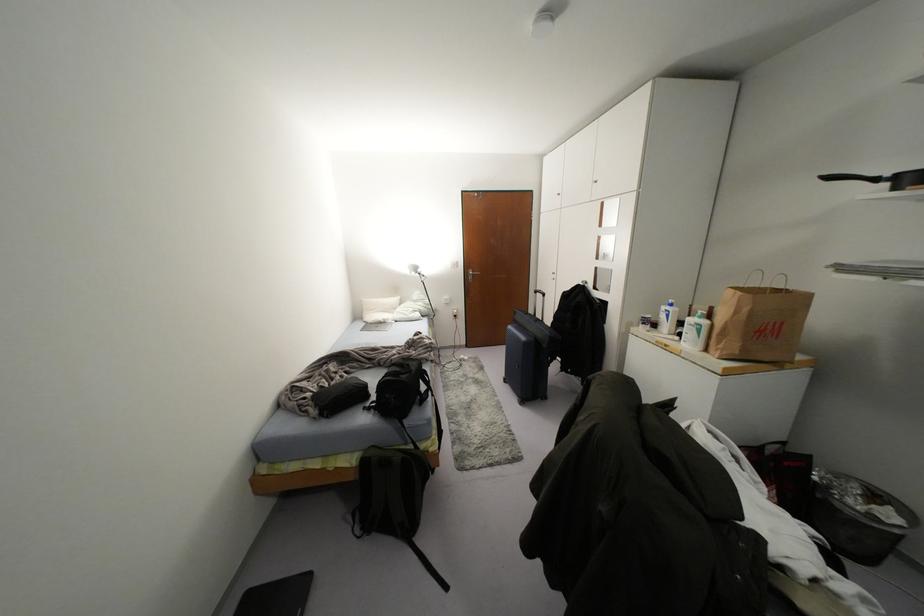
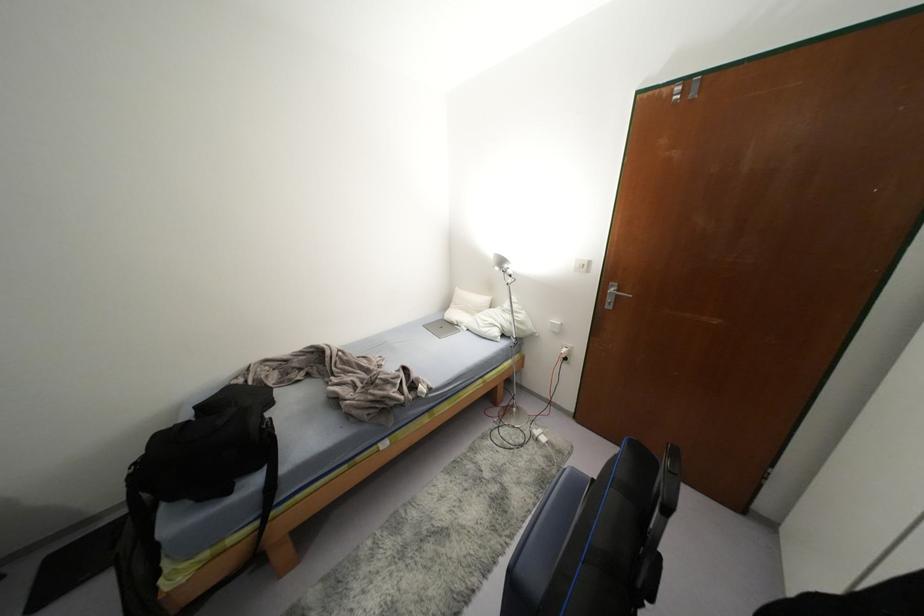
In the second image, find the point that corresponds to pixel 394 299 in the first image.

(484, 299)